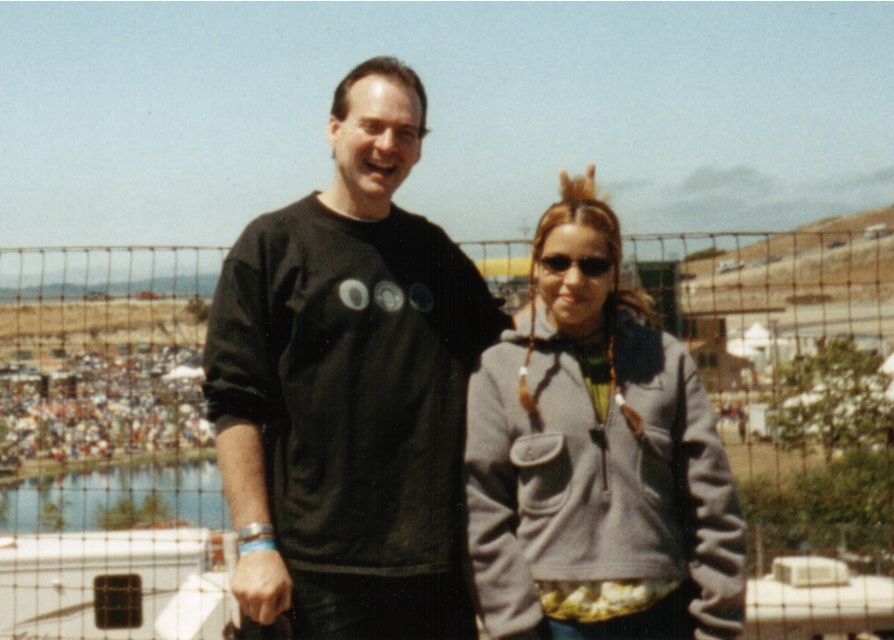
You are a photographer trying to capture a clear shot of the gray fleece jacket at center without the black plastic sunglasses at upper center blocking it. Is this possible given their positions?

The gray fleece jacket at center is in front of the black plastic sunglasses at upper center, so it is blocking the view of the sunglasses. Therefore, you cannot capture a clear shot of the gray fleece jacket at center without the sunglasses being in the frame.

In the scene shown: You are a photographer trying to capture a shot of the gray fleece jacket at center and the black plastic sunglasses at upper center. Which object should you focus on first if you want to take a photo from left to right?

The black plastic sunglasses at upper center should be focused on first because the gray fleece jacket at center is positioned to its right side.